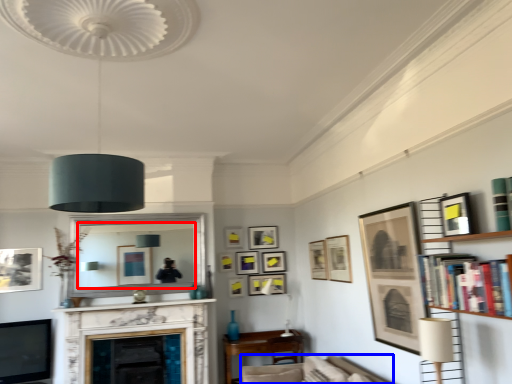
Question: Which object is further to the camera taking this photo, mirror (highlighted by a red box) or swivel chair (highlighted by a blue box)?

Choices:
 (A) mirror
 (B) swivel chair

Answer: (A)